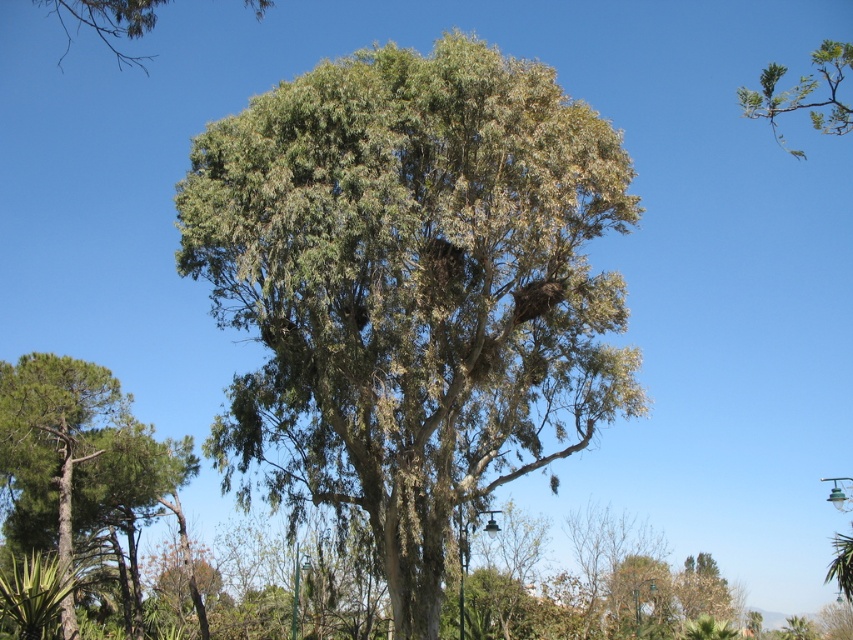
Question: Which point is farther to the camera?

Choices:
 (A) green leafy tree at center
 (B) green needle-like at left

Answer: (B)

Question: Which of the following is the farthest from the observer?

Choices:
 (A) (136, 3)
 (B) (831, 120)

Answer: (B)

Question: Does green leafy branch at upper right have a smaller size compared to green leafy tree at upper left?

Choices:
 (A) no
 (B) yes

Answer: (A)

Question: Is green leafy tree at center smaller than green needle-like at left?

Choices:
 (A) yes
 (B) no

Answer: (A)

Question: Which of the following is the closest to the observer?

Choices:
 (A) (766, 74)
 (B) (39, 440)
 (C) (115, 38)
 (D) (277, 456)

Answer: (A)

Question: Does green leafy tree at center have a greater width compared to green leafy tree at upper left?

Choices:
 (A) yes
 (B) no

Answer: (B)